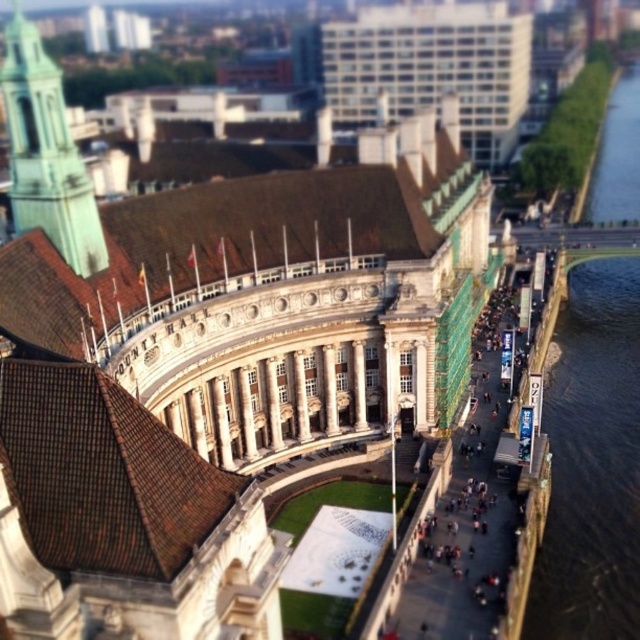
Does green water at right have a lesser height compared to green glass tower at upper left?

In fact, green water at right may be taller than green glass tower at upper left.

Does green water at right have a lesser width compared to green glass tower at upper left?

In fact, green water at right might be wider than green glass tower at upper left.

The width and height of the screenshot is (640, 640). I want to click on green water at right, so click(x=592, y=461).